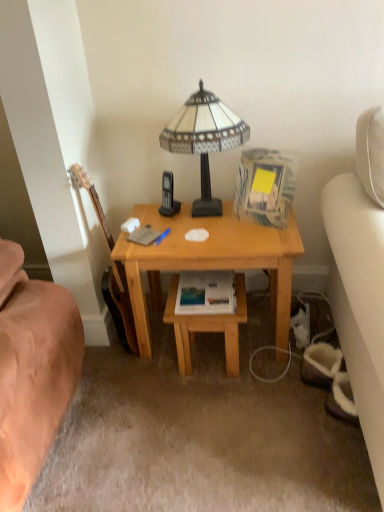
The image size is (384, 512). I want to click on free location above light brown wood table at center (from a real-world perspective), so click(x=210, y=292).